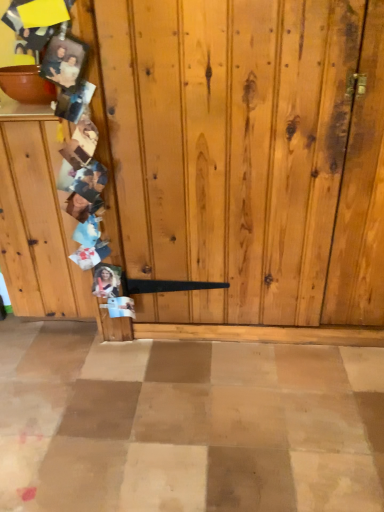
The height and width of the screenshot is (512, 384). Describe the element at coordinates (26, 85) in the screenshot. I see `matte brown bowl at upper left` at that location.

Where is `matte brown bowl at upper left`? This screenshot has height=512, width=384. matte brown bowl at upper left is located at coordinates (26, 85).

Measure the distance between wooden photo collage at left and camera.

They are 1.41 meters apart.

Locate an element on the screen. The width and height of the screenshot is (384, 512). wooden photo collage at left is located at coordinates (38, 222).

Image resolution: width=384 pixels, height=512 pixels. What do you see at coordinates (38, 222) in the screenshot?
I see `wooden photo collage at left` at bounding box center [38, 222].

What is the approximate height of wooden photo collage at left?

The height of wooden photo collage at left is 35.52 inches.

This screenshot has height=512, width=384. In order to click on matte brown bowl at upper left in this screenshot , I will do `click(26, 85)`.

Considering the relative positions of wooden photo collage at left and matte brown bowl at upper left in the image provided, is wooden photo collage at left to the left or to the right of matte brown bowl at upper left?

Clearly, wooden photo collage at left is on the right of matte brown bowl at upper left in the image.

Relative to matte brown bowl at upper left, is wooden photo collage at left in front or behind?

In the image, wooden photo collage at left appears in front of matte brown bowl at upper left.

Considering the points (32, 156) and (33, 86), which point is in front, point (32, 156) or point (33, 86)?

The point (32, 156) is in front.

From the image's perspective, is wooden photo collage at left located above or below matte brown bowl at upper left?

wooden photo collage at left is situated lower than matte brown bowl at upper left in the image.

From a real-world perspective, which is physically below, wooden photo collage at left or matte brown bowl at upper left?

From a 3D spatial view, wooden photo collage at left is below.

Between wooden photo collage at left and matte brown bowl at upper left, which one has smaller width?

Thinner between the two is matte brown bowl at upper left.

Considering the relative sizes of wooden photo collage at left and matte brown bowl at upper left in the image provided, is wooden photo collage at left shorter than matte brown bowl at upper left?

No, wooden photo collage at left is not shorter than matte brown bowl at upper left.

Is wooden photo collage at left bigger or smaller than matte brown bowl at upper left?

wooden photo collage at left is bigger than matte brown bowl at upper left.

Is wooden photo collage at left situated inside matte brown bowl at upper left or outside?

wooden photo collage at left lies outside matte brown bowl at upper left.

Is wooden photo collage at left touching matte brown bowl at upper left?

No, wooden photo collage at left is not next to matte brown bowl at upper left.

Is wooden photo collage at left looking in the opposite direction of matte brown bowl at upper left?

No, wooden photo collage at left is not facing away from matte brown bowl at upper left.

You are a GUI agent. You are given a task and a screenshot of the screen. Output one action in this format:
    pyautogui.click(x=<x>, y=<y>)
    Task: Click on the bowl above the wooden photo collage at left (from the image's perspective)
    Image resolution: width=384 pixels, height=512 pixels.
    Given the screenshot: What is the action you would take?
    pyautogui.click(x=26, y=85)

Considering the positions of objects matte brown bowl at upper left and wooden photo collage at left in the image provided, who is more to the right, matte brown bowl at upper left or wooden photo collage at left?

From the viewer's perspective, wooden photo collage at left appears more on the right side.

Is matte brown bowl at upper left positioned behind wooden photo collage at left?

Yes, the depth of matte brown bowl at upper left is greater than that of wooden photo collage at left.

Which is behind, point (19, 75) or point (16, 312)?

The point (16, 312) is more distant.

From the image's perspective, is matte brown bowl at upper left beneath wooden photo collage at left?

No.

From a real-world perspective, which object rests below the other?

wooden photo collage at left, from a real-world perspective.

Which object is wider, matte brown bowl at upper left or wooden photo collage at left?

wooden photo collage at left.

Is matte brown bowl at upper left taller or shorter than wooden photo collage at left?

Clearly, matte brown bowl at upper left is shorter compared to wooden photo collage at left.

Who is bigger, matte brown bowl at upper left or wooden photo collage at left?

Bigger between the two is wooden photo collage at left.

Choose the correct answer: Is matte brown bowl at upper left inside wooden photo collage at left or outside it?

matte brown bowl at upper left is outside wooden photo collage at left.

From the picture: Are matte brown bowl at upper left and wooden photo collage at left far apart?

matte brown bowl at upper left is actually quite close to wooden photo collage at left.

Is matte brown bowl at upper left turned away from wooden photo collage at left?

That's not correct — matte brown bowl at upper left is not looking away from wooden photo collage at left.

How much distance is there between matte brown bowl at upper left and wooden photo collage at left?

39.03 centimeters.

At what (x,y) coordinates should I click in order to perform the action: click on dresser below the matte brown bowl at upper left (from a real-world perspective). Please return your answer as a coordinate pair (x, y). The image size is (384, 512). Looking at the image, I should click on (38, 222).

You are a GUI agent. You are given a task and a screenshot of the screen. Output one action in this format:
    pyautogui.click(x=<x>, y=<y>)
    Task: Click on the dresser located underneath the matte brown bowl at upper left (from a real-world perspective)
    
    Given the screenshot: What is the action you would take?
    pyautogui.click(x=38, y=222)

I want to click on dresser to the right of matte brown bowl at upper left, so click(x=38, y=222).